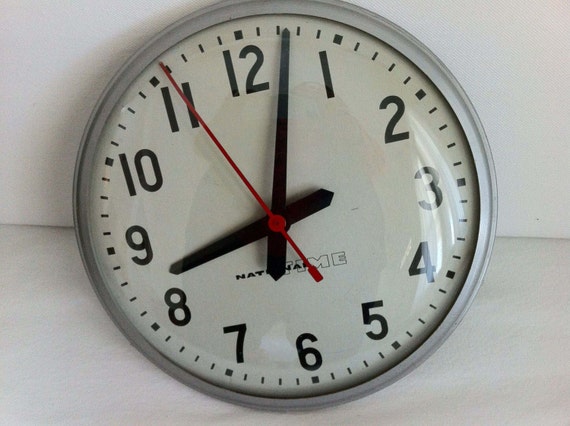
This screenshot has height=426, width=570. Find the location of `clock`. clock is located at coordinates (366, 198).